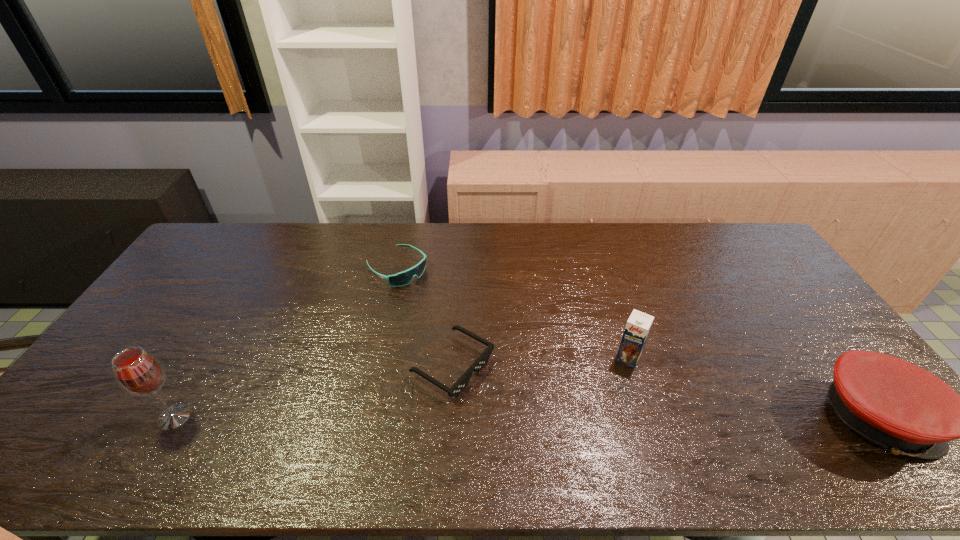
Locate an element on the screen. vacant area located on the front-facing side of the fourth tallest object is located at coordinates (427, 292).

What are the coordinates of `vacant space located 0.400m on the front-facing side of the fourth tallest object` in the screenshot? It's located at pyautogui.click(x=502, y=350).

Locate an element on the screen. vacant space situated 0.150m on the front-facing side of the shortest object is located at coordinates (537, 416).

Locate an element on the screen. This screenshot has height=540, width=960. vacant space located on the front-facing side of the shortest object is located at coordinates (558, 429).

At what (x,y) coordinates should I click in order to perform the action: click on vacant area situated on the front-facing side of the shortest object. Please return your answer as a coordinate pair (x, y). The image size is (960, 540). Looking at the image, I should click on (519, 406).

Identify the location of vacant region located 0.180m on the front label of the chocolate milk. The height and width of the screenshot is (540, 960). (599, 415).

In order to click on free space located 0.090m on the front label of the chocolate milk in this screenshot , I will do `click(612, 390)`.

Find the location of a particular element. The image size is (960, 540). object located in the far edge section of the desktop is located at coordinates (403, 278).

I want to click on wineglass present at the near edge, so click(137, 372).

Where is `sunglasses that is at the near edge`? This screenshot has height=540, width=960. sunglasses that is at the near edge is located at coordinates (x=481, y=361).